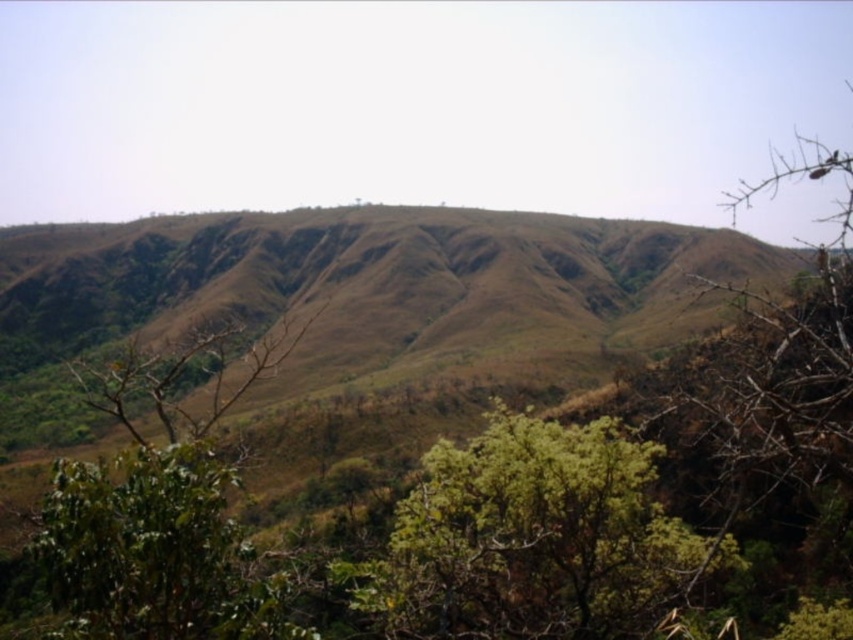
You are standing at the point labeled as point (535, 538) in the image. What can you see around you?

You are standing at the point labeled as point (535, 538), which indicates a green leafy tree at center. Around you, you would see the vast, undulating landscape of rolling hills covered in sparse vegetation, with dense clusters of leafy green bushes and trees in the foreground and the dry, barren hills in the background.